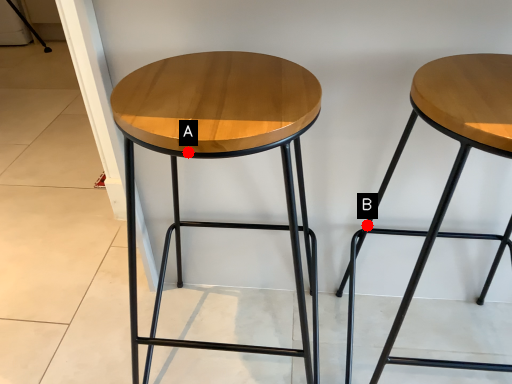
Question: Two points are circled on the image, labeled by A and B beside each circle. Which of the following is the farthest from the observer?

Choices:
 (A) A is further
 (B) B is further

Answer: (B)